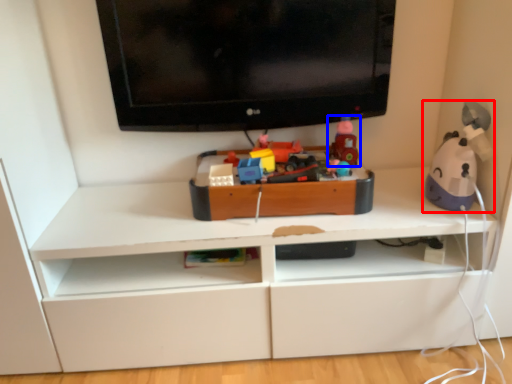
Question: Which of the following is the closest to the observer, toy (highlighted by a red box) or toy (highlighted by a blue box)?

Choices:
 (A) toy
 (B) toy

Answer: (A)